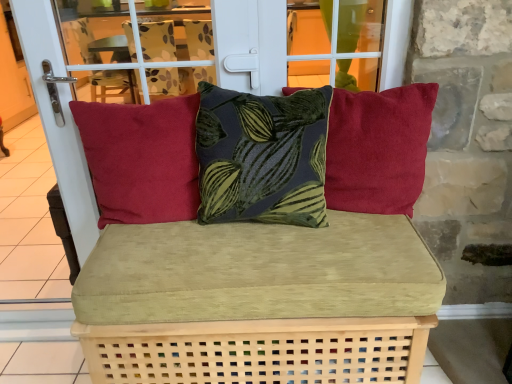
Question: Is velvet green leaf-patterned pillow at center, the 2th pillow in the left-to-right sequence, at the left side of matte red cushion at right, the third pillow when ordered from left to right?

Choices:
 (A) no
 (B) yes

Answer: (B)

Question: Is velvet green leaf-patterned pillow at center, the 2th pillow in the left-to-right sequence, placed right next to matte red cushion at right, the first pillow in the right-to-left sequence?

Choices:
 (A) no
 (B) yes

Answer: (A)

Question: Is velvet green leaf-patterned pillow at center, the 2th pillow in the left-to-right sequence, facing towards matte red cushion at right, the first pillow in the right-to-left sequence?

Choices:
 (A) yes
 (B) no

Answer: (B)

Question: Can you confirm if velvet green leaf-patterned pillow at center, the second pillow in the right-to-left sequence, is positioned to the right of matte red cushion at right, the third pillow when ordered from left to right?

Choices:
 (A) yes
 (B) no

Answer: (B)

Question: Is velvet green leaf-patterned pillow at center, the 2th pillow in the left-to-right sequence, closer to the viewer compared to matte red cushion at right, the third pillow when ordered from left to right?

Choices:
 (A) no
 (B) yes

Answer: (B)

Question: From their relative heights in the image, would you say velvet green leaf-patterned pillow at center, the 2th pillow in the left-to-right sequence, is taller or shorter than velvet green cushion at center?

Choices:
 (A) tall
 (B) short

Answer: (B)

Question: From the image's perspective, relative to velvet green cushion at center, is velvet green leaf-patterned pillow at center, the 2th pillow in the left-to-right sequence, above or below?

Choices:
 (A) above
 (B) below

Answer: (A)

Question: In terms of width, does velvet green leaf-patterned pillow at center, the 2th pillow in the left-to-right sequence, look wider or thinner when compared to velvet green cushion at center?

Choices:
 (A) wide
 (B) thin

Answer: (B)

Question: Considering the positions of point (266, 160) and point (398, 274), is point (266, 160) closer or farther from the camera than point (398, 274)?

Choices:
 (A) farther
 (B) closer

Answer: (A)

Question: Is matte red cushion at left, acting as the third pillow starting from the right, wider or thinner than matte red cushion at right, the third pillow when ordered from left to right?

Choices:
 (A) thin
 (B) wide

Answer: (B)

Question: Considering the positions of matte red cushion at left, acting as the third pillow starting from the right, and matte red cushion at right, the third pillow when ordered from left to right, in the image, is matte red cushion at left, acting as the third pillow starting from the right, taller or shorter than matte red cushion at right, the third pillow when ordered from left to right,?

Choices:
 (A) short
 (B) tall

Answer: (B)

Question: Based on their sizes in the image, would you say matte red cushion at left, positioned as the 1th pillow in left-to-right order, is bigger or smaller than matte red cushion at right, the first pillow in the right-to-left sequence?

Choices:
 (A) big
 (B) small

Answer: (A)

Question: Relative to matte red cushion at right, the third pillow when ordered from left to right, is matte red cushion at left, positioned as the 1th pillow in left-to-right order, in front or behind?

Choices:
 (A) behind
 (B) front

Answer: (A)

Question: From the image's perspective, relative to velvet green leaf-patterned pillow at center, the second pillow in the right-to-left sequence, is matte red cushion at left, acting as the third pillow starting from the right, above or below?

Choices:
 (A) below
 (B) above

Answer: (A)

Question: Based on their sizes in the image, would you say matte red cushion at left, positioned as the 1th pillow in left-to-right order, is bigger or smaller than velvet green leaf-patterned pillow at center, the 2th pillow in the left-to-right sequence?

Choices:
 (A) small
 (B) big

Answer: (A)